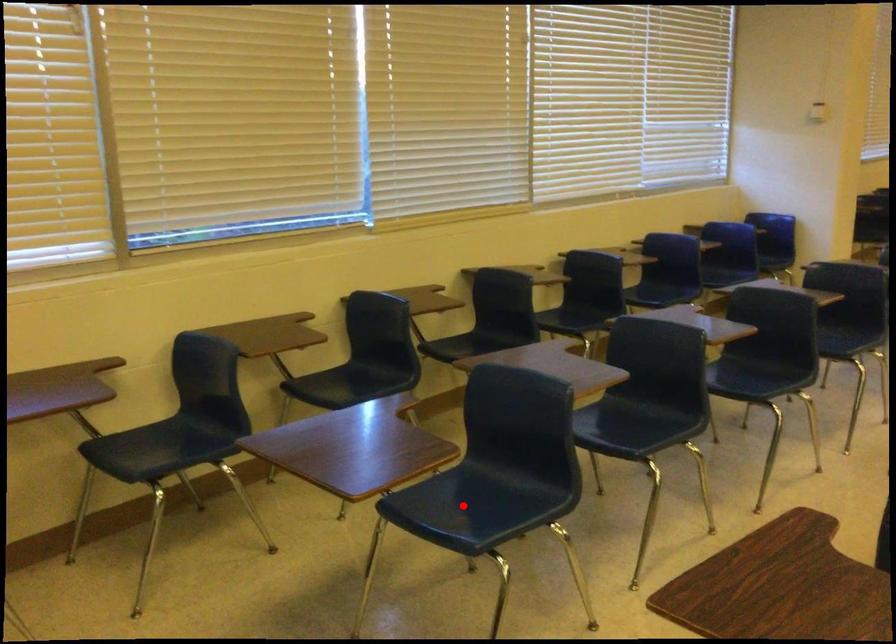
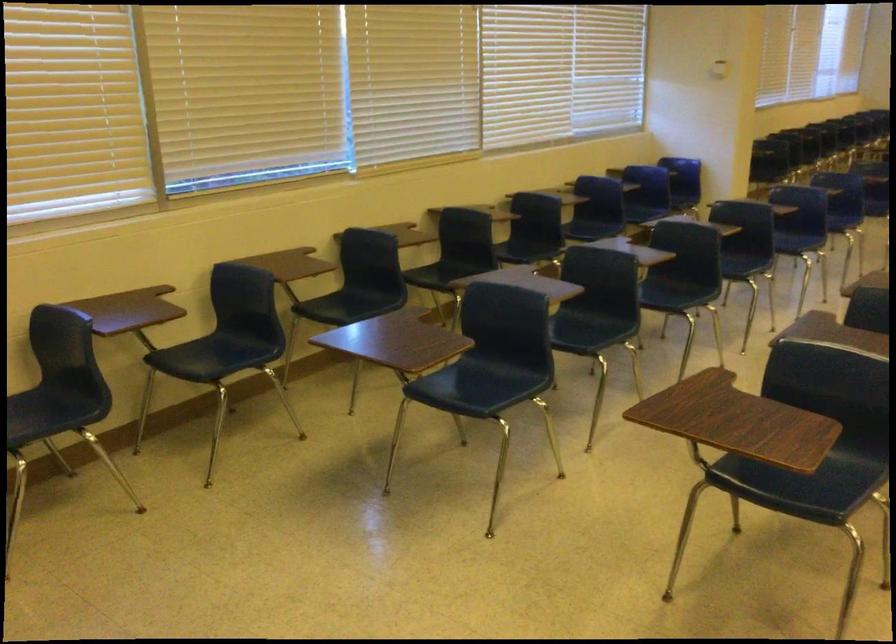
Locate, in the second image, the point that corresponds to the highlighted location in the first image.

(467, 386)